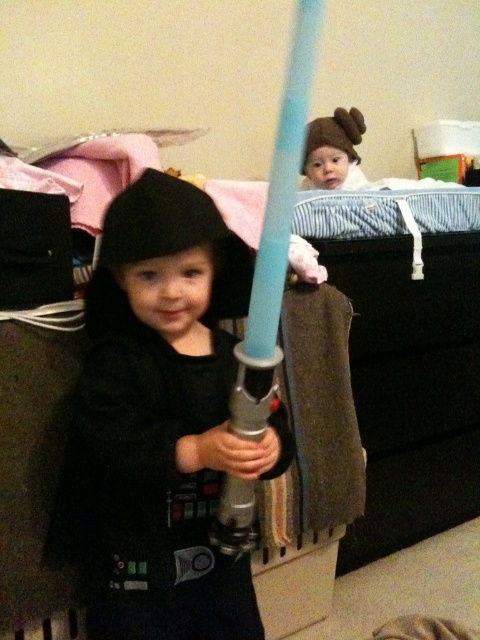
Is matte black costume at center smaller than light blue plastic sword at center?

No, matte black costume at center is not smaller than light blue plastic sword at center.

Who is lower down, matte black costume at center or light blue plastic sword at center?

matte black costume at center is below.

This screenshot has height=640, width=480. I want to click on matte black costume at center, so click(x=160, y=422).